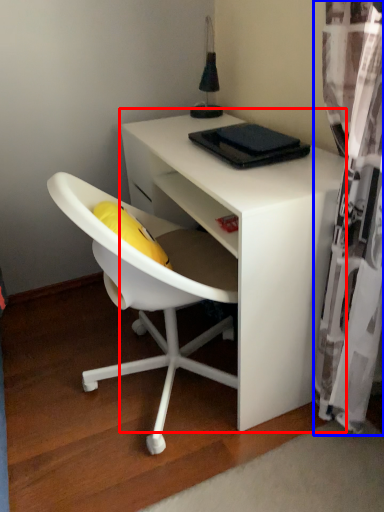
Question: Which object appears closest to the camera in this image, desk (highlighted by a red box) or curtain (highlighted by a blue box)?

Choices:
 (A) desk
 (B) curtain

Answer: (B)